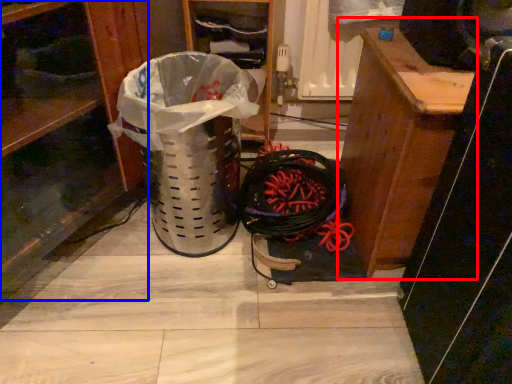
Question: Which point is further to the camera, furniture (highlighted by a red box) or shelf (highlighted by a blue box)?

Choices:
 (A) furniture
 (B) shelf

Answer: (A)